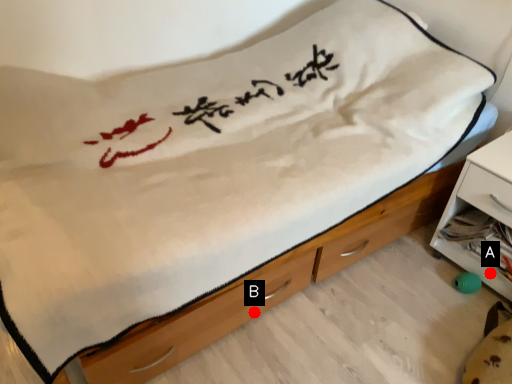
Question: Two points are circled on the image, labeled by A and B beside each circle. Which point is further to the camera?

Choices:
 (A) A is further
 (B) B is further

Answer: (A)